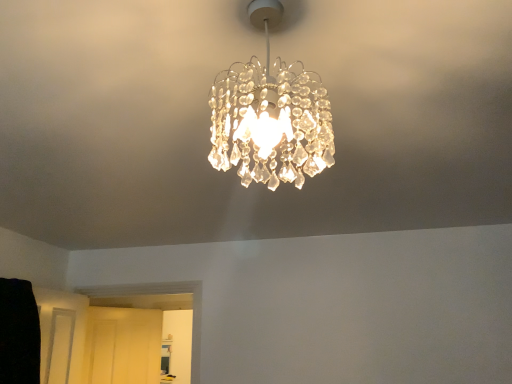
Where is `matte white door at lower left`? The image size is (512, 384). matte white door at lower left is located at coordinates click(x=123, y=345).

This screenshot has width=512, height=384. What do you see at coordinates (123, 345) in the screenshot? I see `matte white door at lower left` at bounding box center [123, 345].

This screenshot has width=512, height=384. I want to click on clear crystal chandelier at center, so click(270, 115).

What is the approximate width of clear crystal chandelier at center?

clear crystal chandelier at center is 26.60 centimeters in width.

Measure the distance between point [272,109] and camera.

They are 31.54 inches apart.

The width and height of the screenshot is (512, 384). Describe the element at coordinates (270, 115) in the screenshot. I see `clear crystal chandelier at center` at that location.

Measure the distance between clear crystal chandelier at center and camera.

clear crystal chandelier at center and camera are 30.00 inches apart.

Locate an element on the screen. matte white door at lower left is located at coordinates (123, 345).

Which is more to the left, matte white door at lower left or clear crystal chandelier at center?

From the viewer's perspective, matte white door at lower left appears more on the left side.

Relative to clear crystal chandelier at center, is matte white door at lower left in front or behind?

In the image, matte white door at lower left appears behind clear crystal chandelier at center.

Considering the positions of points (125, 335) and (233, 143), is point (125, 335) farther from camera compared to point (233, 143)?

Yes, it is behind point (233, 143).

From the image's perspective, relative to clear crystal chandelier at center, is matte white door at lower left above or below?

matte white door at lower left is situated lower than clear crystal chandelier at center in the image.

From a real-world perspective, is matte white door at lower left above or below clear crystal chandelier at center?

Clearly, from a real-world perspective, matte white door at lower left is below clear crystal chandelier at center.

Does matte white door at lower left have a greater width compared to clear crystal chandelier at center?

In fact, matte white door at lower left might be narrower than clear crystal chandelier at center.

From their relative heights in the image, would you say matte white door at lower left is taller or shorter than clear crystal chandelier at center?

matte white door at lower left is taller than clear crystal chandelier at center.

Considering the relative sizes of matte white door at lower left and clear crystal chandelier at center in the image provided, is matte white door at lower left bigger than clear crystal chandelier at center?

Correct, matte white door at lower left is larger in size than clear crystal chandelier at center.

Choose the correct answer: Is matte white door at lower left inside clear crystal chandelier at center or outside it?

matte white door at lower left is located beyond the bounds of clear crystal chandelier at center.

Are matte white door at lower left and clear crystal chandelier at center beside each other?

No.

Is matte white door at lower left looking in the opposite direction of clear crystal chandelier at center?

No, matte white door at lower left's orientation is not away from clear crystal chandelier at center.

Find the location of `lamp lying on the right of matte white door at lower left`. lamp lying on the right of matte white door at lower left is located at coordinates (270, 115).

Is clear crystal chandelier at center to the right of matte white door at lower left from the viewer's perspective?

Indeed, clear crystal chandelier at center is positioned on the right side of matte white door at lower left.

Does clear crystal chandelier at center come in front of matte white door at lower left?

Yes, clear crystal chandelier at center is in front of matte white door at lower left.

Which is farther from the camera, (319, 103) or (139, 360)?

The point (139, 360) is more distant.

In the scene shown: From the image's perspective, relative to matte white door at lower left, is clear crystal chandelier at center above or below?

From the image's perspective, clear crystal chandelier at center appears above matte white door at lower left.

From a real-world perspective, does clear crystal chandelier at center stand above matte white door at lower left?

Yes, from a real-world perspective, clear crystal chandelier at center is on top of matte white door at lower left.

Between clear crystal chandelier at center and matte white door at lower left, which one has larger width?

clear crystal chandelier at center.

Can you confirm if clear crystal chandelier at center is taller than matte white door at lower left?

No.

Between clear crystal chandelier at center and matte white door at lower left, which one has larger size?

matte white door at lower left.

Would you say clear crystal chandelier at center is outside matte white door at lower left?

That's correct, clear crystal chandelier at center is outside of matte white door at lower left.

Is clear crystal chandelier at center positioned far away from matte white door at lower left?

clear crystal chandelier at center is far away from matte white door at lower left.

Is clear crystal chandelier at center oriented towards matte white door at lower left?

Yes, clear crystal chandelier at center is turned towards matte white door at lower left.

How different are the orientations of clear crystal chandelier at center and matte white door at lower left in degrees?

The angle between the facing direction of clear crystal chandelier at center and the facing direction of matte white door at lower left is 144 degrees.

Where is `glass door located underneath the clear crystal chandelier at center (from a real-world perspective)`? glass door located underneath the clear crystal chandelier at center (from a real-world perspective) is located at coordinates (123, 345).

At what (x,y) coordinates should I click in order to perform the action: click on lamp that appears above the matte white door at lower left (from the image's perspective). Please return your answer as a coordinate pair (x, y). Image resolution: width=512 pixels, height=384 pixels. Looking at the image, I should click on (270, 115).

Locate an element on the screen. This screenshot has width=512, height=384. glass door on the left of clear crystal chandelier at center is located at coordinates (123, 345).